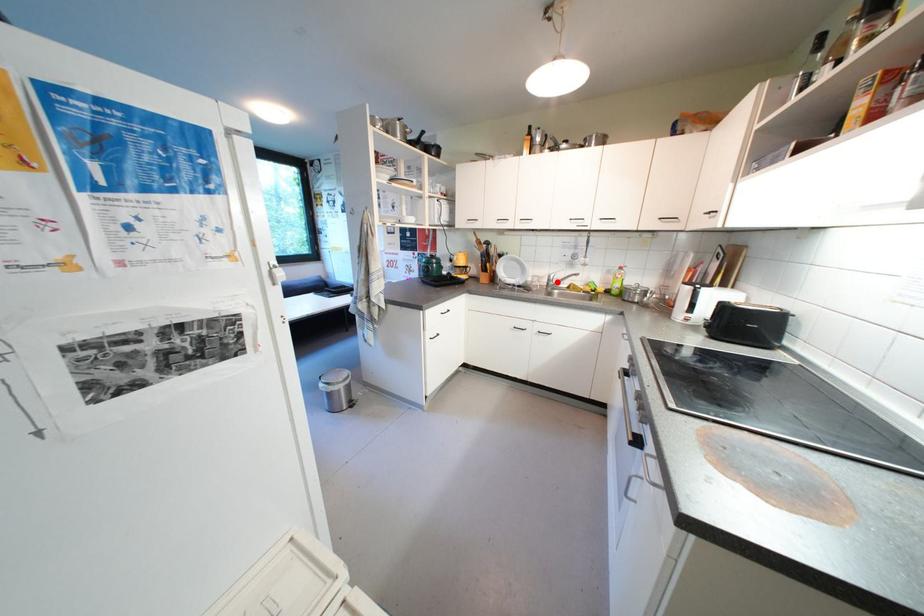
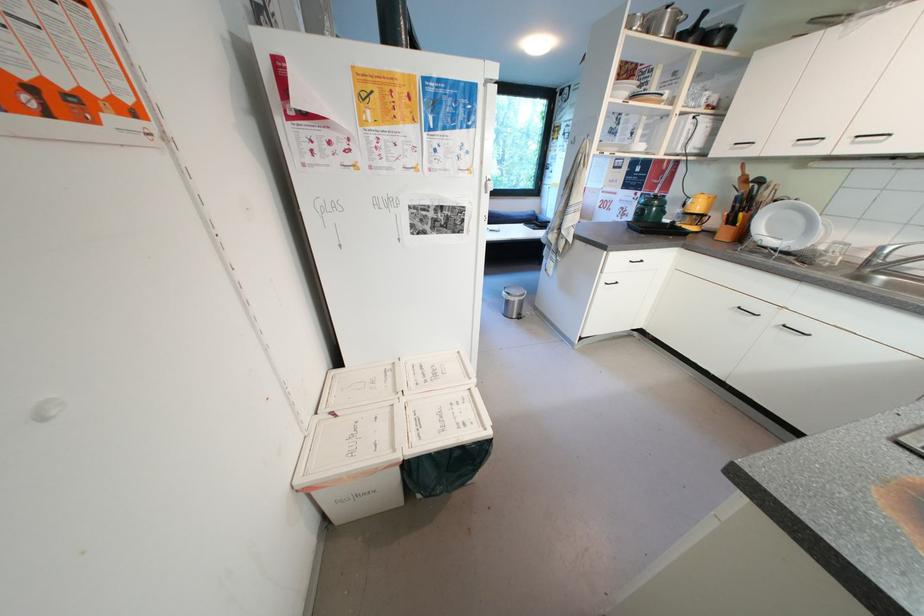
Locate, in the second image, the point that corresponds to the highlighted location in the first image.

(883, 257)